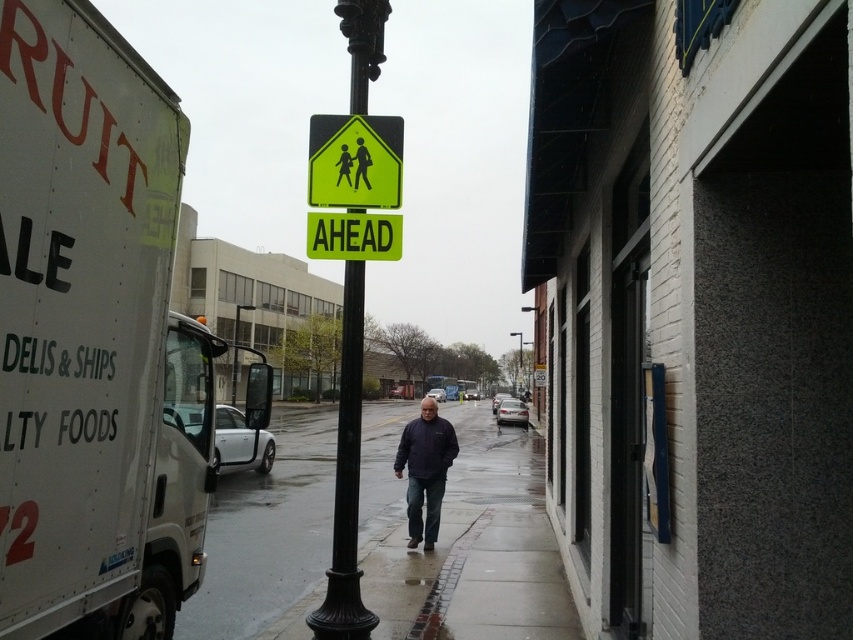
You are a delivery driver who needs to park your truck near the yellow reflective plastic pedestrian crossing sign at center and the yellow reflective pedestrian sign at center. The parking spot you found is 4 feet wide. Can both signs fit side by side in the parking spot?

The distance between the yellow reflective plastic pedestrian crossing sign at center and the yellow reflective pedestrian sign at center is 4.19 inches. Since 4 feet is 48 inches, there is ample space to fit both signs side by side in the parking spot.

You are a delivery person driving a 7.5 feet wide truck. You need to park your truck between the green matte pedestrian crossing sign at center and the yellow reflective pedestrian sign at center. Is there enough space between them to park your truck?

The distance between the green matte pedestrian crossing sign at center and the yellow reflective pedestrian sign at center is 12.01 inches. Since the truck is 7.5 feet wide, which is significantly wider, there is not enough space to park the truck between them.